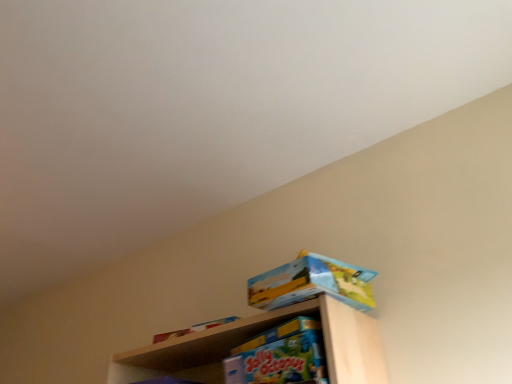
Question: From the image's perspective, is matte cardboard box at upper right, which appears as the 2th toy when ordered from the bottom, beneath matte blue board game at center, acting as the first toy starting from the bottom?

Choices:
 (A) no
 (B) yes

Answer: (A)

Question: Can you confirm if matte cardboard box at upper right, which appears as the 2th toy when ordered from the bottom, is positioned to the right of matte blue board game at center, acting as the first toy starting from the bottom?

Choices:
 (A) no
 (B) yes

Answer: (B)

Question: Could matte blue board game at center, which appears as the second toy when viewed from the top, be considered to be inside matte cardboard box at upper right, which ranks as the first toy in top-to-bottom order?

Choices:
 (A) no
 (B) yes

Answer: (A)

Question: From a real-world perspective, is matte cardboard box at upper right, which ranks as the first toy in top-to-bottom order, on top of matte blue board game at center, acting as the first toy starting from the bottom?

Choices:
 (A) yes
 (B) no

Answer: (A)

Question: Can you confirm if matte cardboard box at upper right, which appears as the 2th toy when ordered from the bottom, is positioned to the left of matte blue board game at center, which appears as the second toy when viewed from the top?

Choices:
 (A) yes
 (B) no

Answer: (B)

Question: Are matte cardboard box at upper right, which appears as the 2th toy when ordered from the bottom, and matte blue board game at center, acting as the first toy starting from the bottom, making contact?

Choices:
 (A) yes
 (B) no

Answer: (B)

Question: From the image's perspective, is matte blue board game at center, acting as the first toy starting from the bottom, located above matte cardboard box at upper right, which appears as the 2th toy when ordered from the bottom?

Choices:
 (A) yes
 (B) no

Answer: (B)

Question: Can you confirm if matte blue board game at center, acting as the first toy starting from the bottom, is thinner than matte cardboard box at upper right, which appears as the 2th toy when ordered from the bottom?

Choices:
 (A) no
 (B) yes

Answer: (A)

Question: Is matte cardboard box at upper right, which appears as the 2th toy when ordered from the bottom, at the back of matte blue board game at center, which appears as the second toy when viewed from the top?

Choices:
 (A) yes
 (B) no

Answer: (B)

Question: From a real-world perspective, is matte blue board game at center, acting as the first toy starting from the bottom, below matte cardboard box at upper right, which ranks as the first toy in top-to-bottom order?

Choices:
 (A) no
 (B) yes

Answer: (B)

Question: Is matte blue board game at center, which appears as the second toy when viewed from the top, far from matte cardboard box at upper right, which ranks as the first toy in top-to-bottom order?

Choices:
 (A) yes
 (B) no

Answer: (B)

Question: From the image's perspective, is matte blue board game at center, which appears as the second toy when viewed from the top, located beneath matte cardboard box at upper right, which ranks as the first toy in top-to-bottom order?

Choices:
 (A) no
 (B) yes

Answer: (B)

Question: Is matte cardboard box at upper right, which ranks as the first toy in top-to-bottom order, to the left or to the right of matte blue board game at center, acting as the first toy starting from the bottom, in the image?

Choices:
 (A) right
 (B) left

Answer: (A)